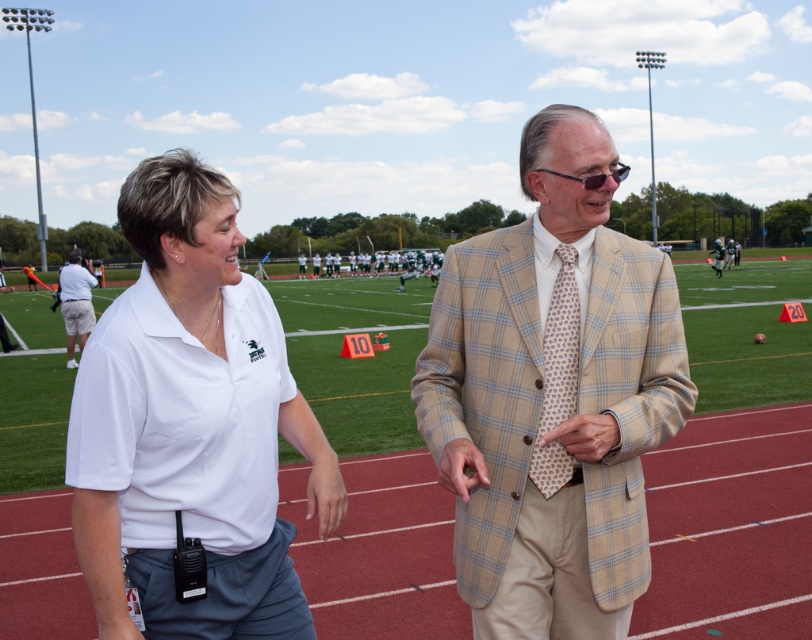
Question: Is beige plaid suit at center positioned behind plaid beige blazer at center?

Choices:
 (A) no
 (B) yes

Answer: (A)

Question: Is beige plaid suit at center bigger than khaki shorts at left?

Choices:
 (A) no
 (B) yes

Answer: (A)

Question: Which object appears closest to the camera in this image?

Choices:
 (A) white cotton polo shirt at center
 (B) khaki shorts at left
 (C) beige plaid suit at center

Answer: (A)

Question: Considering the real-world distances, which object is closest to the plaid beige blazer at center?

Choices:
 (A) white cotton polo shirt at center
 (B) khaki shorts at left
 (C) beige plaid suit at center

Answer: (B)

Question: From the image, what is the correct spatial relationship of white cotton polo shirt at center in relation to plaid beige blazer at center?

Choices:
 (A) right
 (B) left

Answer: (B)

Question: Which of the following is the farthest from the observer?

Choices:
 (A) (711, 268)
 (B) (530, 141)
 (C) (117, 618)

Answer: (A)